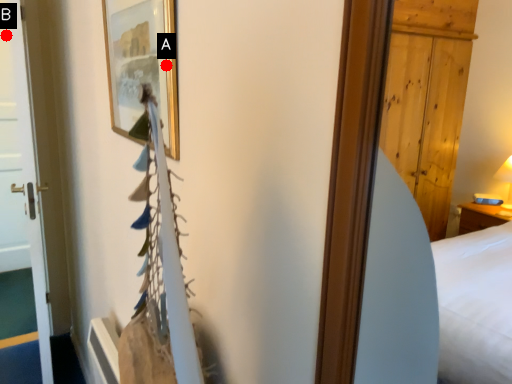
Question: Two points are circled on the image, labeled by A and B beside each circle. Which of the following is the closest to the observer?

Choices:
 (A) A is closer
 (B) B is closer

Answer: (A)